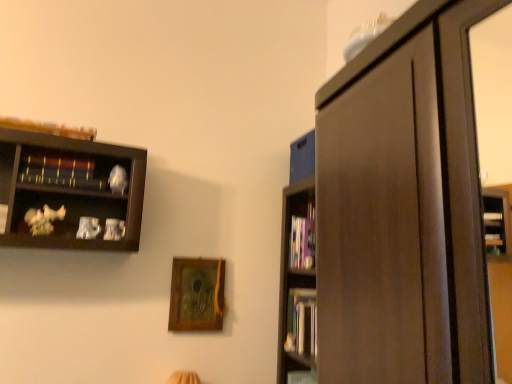
Describe the element at coordinates (303, 240) in the screenshot. I see `hardcover book at center, arranged as the third book when viewed from the top` at that location.

Find the location of a particular element. The height and width of the screenshot is (384, 512). hardcover book at center, acting as the fourth book starting from the front is located at coordinates (303, 240).

This screenshot has width=512, height=384. What do you see at coordinates (48, 128) in the screenshot? I see `wooden book at upper left, which ranks as the fourth book in right-to-left order` at bounding box center [48, 128].

Find the location of a particular element. The image size is (512, 384). wooden book at upper left, which ranks as the fourth book in right-to-left order is located at coordinates (48, 128).

Locate an element on the screen. hardcover book at center, acting as the fourth book starting from the front is located at coordinates (303, 240).

From the image's perspective, which one is positioned higher, hardcover books at right, marked as the 1th book in a bottom-to-top arrangement, or hardcover book at center, arranged as the third book when viewed from the top?

hardcover book at center, arranged as the third book when viewed from the top, is shown above in the image.

The width and height of the screenshot is (512, 384). I want to click on the 1st book directly above the hardcover books at right, marked as the 1th book in a bottom-to-top arrangement (from a real-world perspective), so click(x=303, y=240).

Does hardcover books at right, marked as the 1th book in a bottom-to-top arrangement, have a lesser width compared to hardcover book at center, which ranks as the fourth book in left-to-right order?

Correct, the width of hardcover books at right, marked as the 1th book in a bottom-to-top arrangement, is less than that of hardcover book at center, which ranks as the fourth book in left-to-right order.

Based on their positions, is hardcover books at right, marked as the second book in a right-to-left arrangement, located to the left or right of hardcover book at center, which ranks as the fourth book in left-to-right order?

hardcover books at right, marked as the second book in a right-to-left arrangement, is to the left of hardcover book at center, which ranks as the fourth book in left-to-right order.

From a real-world perspective, which is physically below, hardcover book at center, which is counted as the first book, starting from the right, or wooden book at upper left, which is the 1th book in top-to-bottom order?

From a 3D spatial view, hardcover book at center, which is counted as the first book, starting from the right, is below.

Looking at this image, can you confirm if hardcover book at center, which is counted as the first book, starting from the right, is smaller than wooden book at upper left, which is counted as the 1th book, starting from the left?

Incorrect, hardcover book at center, which is counted as the first book, starting from the right, is not smaller in size than wooden book at upper left, which is counted as the 1th book, starting from the left.

From the image's perspective, count 2nd books upward from the hardcover book at center, acting as the fourth book starting from the front, and point to it. Please provide its 2D coordinates.

[(48, 128)]

Is there a large distance between hardcover book at center, acting as the fourth book starting from the front, and wooden book at upper left, which ranks as the fourth book in right-to-left order?

That's right, there is a large distance between hardcover book at center, acting as the fourth book starting from the front, and wooden book at upper left, which ranks as the fourth book in right-to-left order.

Where is `book below the hardcover book at center, which ranks as the fourth book in left-to-right order (from a real-world perspective)`? book below the hardcover book at center, which ranks as the fourth book in left-to-right order (from a real-world perspective) is located at coordinates (302, 323).

Who is smaller, hardcover book at center, which ranks as the fourth book in left-to-right order, or hardcover books at right, the third book in the front-to-back sequence?

hardcover book at center, which ranks as the fourth book in left-to-right order.

Considering the sizes of hardcover book at center, arranged as the third book when viewed from the top, and hardcover books at right, placed as the 4th book when sorted from top to bottom, in the image, is hardcover book at center, arranged as the third book when viewed from the top, wider or thinner than hardcover books at right, placed as the 4th book when sorted from top to bottom,?

Clearly, hardcover book at center, arranged as the third book when viewed from the top, has more width compared to hardcover books at right, placed as the 4th book when sorted from top to bottom.

Considering the positions of objects hardcover book at center, arranged as the third book when viewed from the top, and hardcover books at right, marked as the second book in a right-to-left arrangement, in the image provided, who is more to the right, hardcover book at center, arranged as the third book when viewed from the top, or hardcover books at right, marked as the second book in a right-to-left arrangement,?

hardcover book at center, arranged as the third book when viewed from the top.

Consider the image. Which of these two, wooden picture frame at center or hardcover books at right, placed as the 4th book when sorted from top to bottom, is smaller?

wooden picture frame at center.

Can we say wooden picture frame at center lies outside hardcover books at right, placed as the 4th book when sorted from top to bottom?

wooden picture frame at center is positioned outside hardcover books at right, placed as the 4th book when sorted from top to bottom.

Does hardcover book at center, acting as the fourth book starting from the front, have a smaller size compared to wooden bookshelf at upper left, placed as the third book when sorted from bottom to top?

No, hardcover book at center, acting as the fourth book starting from the front, is not smaller than wooden bookshelf at upper left, placed as the third book when sorted from bottom to top.

Does hardcover book at center, arranged as the third book when viewed from the top, have a greater height compared to wooden bookshelf at upper left, positioned as the second book in left-to-right order?

Correct, hardcover book at center, arranged as the third book when viewed from the top, is much taller as wooden bookshelf at upper left, positioned as the second book in left-to-right order.

Could you tell me if hardcover book at center, acting as the fourth book starting from the front, is turned towards wooden bookshelf at upper left, placed as the third book when sorted from bottom to top?

Yes, hardcover book at center, acting as the fourth book starting from the front, is turned towards wooden bookshelf at upper left, placed as the third book when sorted from bottom to top.

From a real-world perspective, does hardcover book at center, which is counted as the first book, starting from the right, stand above wooden bookshelf at upper left, arranged as the second book when viewed from the top?

No, from a real-world perspective, hardcover book at center, which is counted as the first book, starting from the right, is not on top of wooden bookshelf at upper left, arranged as the second book when viewed from the top.

Which of these two, hardcover book at center, arranged as the third book when viewed from the top, or wooden picture frame at center, is bigger?

Bigger between the two is wooden picture frame at center.

Considering the positions of objects hardcover book at center, arranged as the third book when viewed from the top, and wooden picture frame at center in the image provided, who is more to the right, hardcover book at center, arranged as the third book when viewed from the top, or wooden picture frame at center?

From the viewer's perspective, hardcover book at center, arranged as the third book when viewed from the top, appears more on the right side.

Based on the photo, is hardcover book at center, arranged as the third book when viewed from the top, looking in the opposite direction of wooden picture frame at center?

No.

Does hardcover book at center, which ranks as the fourth book in left-to-right order, have a lesser width compared to wooden picture frame at center?

No, hardcover book at center, which ranks as the fourth book in left-to-right order, is not thinner than wooden picture frame at center.

In the scene shown: Which object is positioned more to the left, wooden picture frame at center or wooden bookshelf at upper left, which is the 3th book from back to front?

From the viewer's perspective, wooden bookshelf at upper left, which is the 3th book from back to front, appears more on the left side.

Is the position of wooden picture frame at center more distant than that of wooden bookshelf at upper left, arranged as the second book when viewed from the top?

That is True.

Does wooden picture frame at center have a lesser width compared to wooden bookshelf at upper left, which is the 3th book from back to front?

Yes, wooden picture frame at center is thinner than wooden bookshelf at upper left, which is the 3th book from back to front.

This screenshot has width=512, height=384. Find the location of `book below the hardcover book at center, which is counted as the first book, starting from the right (from a real-world perspective)`. book below the hardcover book at center, which is counted as the first book, starting from the right (from a real-world perspective) is located at coordinates (302, 323).

Where is `the 3rd book to the left of the hardcover book at center, the second book positioned from the bottom, counting from the anchor's position`? The image size is (512, 384). the 3rd book to the left of the hardcover book at center, the second book positioned from the bottom, counting from the anchor's position is located at coordinates (48, 128).

Based on their spatial positions, is wooden bookshelf at upper left, which ranks as the 3th book in right-to-left order, or wooden picture frame at center further from hardcover books at right, which appears as the third book when viewed from the left?

wooden bookshelf at upper left, which ranks as the 3th book in right-to-left order.

From the image, which object appears to be farther from wooden bookshelf at upper left, which ranks as the 3th book in right-to-left order, hardcover book at center, the second book positioned from the bottom, or wooden picture frame at center?

hardcover book at center, the second book positioned from the bottom, lies further to wooden bookshelf at upper left, which ranks as the 3th book in right-to-left order, than the other object.

Based on their spatial positions, is wooden picture frame at center or wooden bookshelf at upper left, placed as the third book when sorted from bottom to top, closer to hardcover books at right, the third book in the front-to-back sequence?

wooden picture frame at center is closer to hardcover books at right, the third book in the front-to-back sequence.

Looking at the image, which one is located closer to wooden picture frame at center, wooden book at upper left, acting as the 4th book starting from the back, or hardcover books at right, which appears as the third book when viewed from the left?

Among the two, hardcover books at right, which appears as the third book when viewed from the left, is located nearer to wooden picture frame at center.

Considering their positions, is hardcover book at center, the second book positioned from the bottom, positioned closer to wooden book at upper left, which ranks as the fourth book in right-to-left order, than wooden bookshelf at upper left, placed as the third book when sorted from bottom to top?

wooden bookshelf at upper left, placed as the third book when sorted from bottom to top, is positioned closer to the anchor wooden book at upper left, which ranks as the fourth book in right-to-left order.

Considering their positions, is wooden picture frame at center positioned further to wooden book at upper left, which ranks as the fourth book in right-to-left order, than hardcover books at right, marked as the second book in a right-to-left arrangement?

hardcover books at right, marked as the second book in a right-to-left arrangement, lies further to wooden book at upper left, which ranks as the fourth book in right-to-left order, than the other object.

Looking at this image, looking at the image, which one is located further to hardcover books at right, the third book in the front-to-back sequence, wooden book at upper left, which is the 1th book in top-to-bottom order, or hardcover book at center, arranged as the 1th book when viewed from the back?

wooden book at upper left, which is the 1th book in top-to-bottom order, lies further to hardcover books at right, the third book in the front-to-back sequence, than the other object.

From the picture: Looking at the image, which one is located further to wooden picture frame at center, wooden book at upper left, which is counted as the 1th book, starting from the left, or hardcover book at center, acting as the fourth book starting from the front?

wooden book at upper left, which is counted as the 1th book, starting from the left, is positioned further to the anchor wooden picture frame at center.

Image resolution: width=512 pixels, height=384 pixels. Find the location of `book situated between wooden bookshelf at upper left, which ranks as the 3th book in right-to-left order, and hardcover book at center, the second book positioned from the bottom, from left to right`. book situated between wooden bookshelf at upper left, which ranks as the 3th book in right-to-left order, and hardcover book at center, the second book positioned from the bottom, from left to right is located at coordinates (302, 323).

Locate an element on the screen. picture frame located between wooden bookshelf at upper left, arranged as the second book when viewed from the top, and hardcover books at right, marked as the 1th book in a bottom-to-top arrangement, in the left-right direction is located at coordinates (197, 294).

What are the coordinates of `picture frame between wooden bookshelf at upper left, arranged as the second book when viewed from the top, and hardcover book at center, which ranks as the fourth book in left-to-right order, from left to right` in the screenshot? It's located at (197, 294).

Identify the location of picture frame between wooden book at upper left, the 1th book from the front, and hardcover book at center, the second book positioned from the bottom, from left to right. The image size is (512, 384). (197, 294).